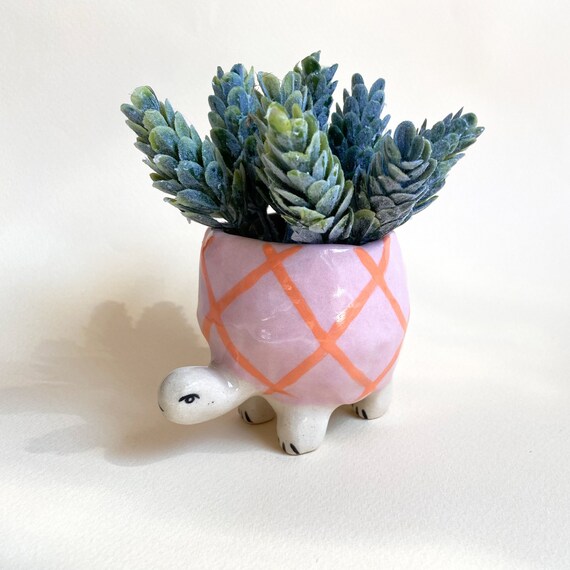
Where is `white turtle pot`? This screenshot has width=570, height=570. white turtle pot is located at coordinates (215, 390).